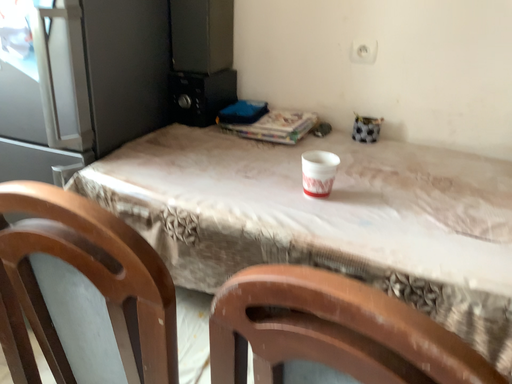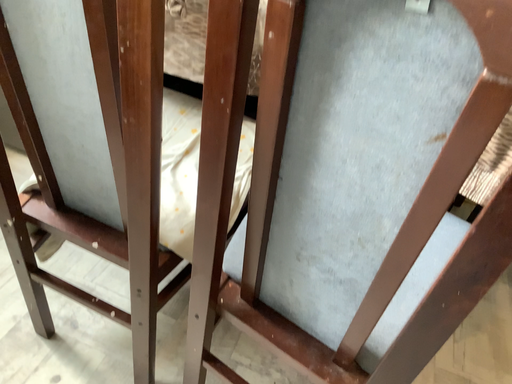
Question: Which way did the camera rotate in the video?

Choices:
 (A) rotated downward
 (B) rotated upward

Answer: (A)